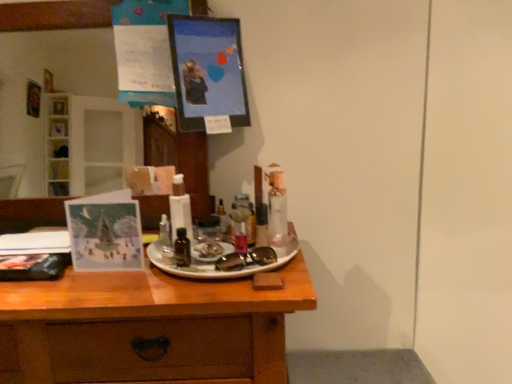
Find the location of a particular element. The height and width of the screenshot is (384, 512). free spot in front of translucent plastic tube at center, the 2th toiletry when ordered from left to right is located at coordinates (210, 290).